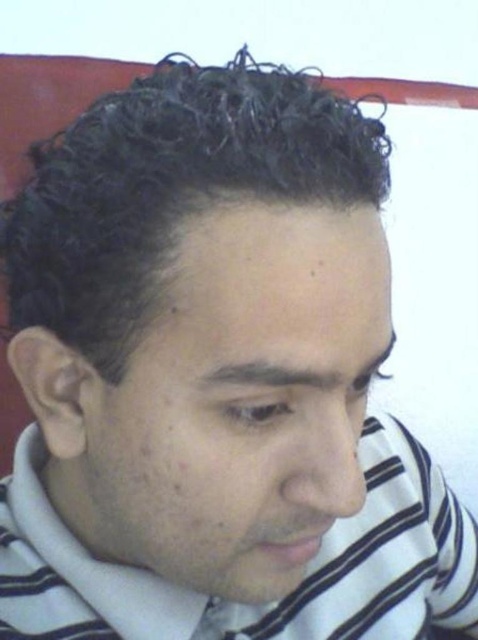
Question: Which point is closer to the camera?

Choices:
 (A) white striped dress shirt at center
 (B) curly black hair at upper center

Answer: (B)

Question: Can you confirm if curly black hair at upper center is thinner than white striped dress shirt at center?

Choices:
 (A) yes
 (B) no

Answer: (A)

Question: Which point is farther to the camera?

Choices:
 (A) curly black hair at upper center
 (B) white striped dress shirt at center

Answer: (B)

Question: Does curly black hair at upper center have a larger size compared to white striped dress shirt at center?

Choices:
 (A) no
 (B) yes

Answer: (A)

Question: Which point is closer to the camera?

Choices:
 (A) (368, 556)
 (B) (257, 116)

Answer: (B)

Question: Can you confirm if curly black hair at upper center is bigger than white striped dress shirt at center?

Choices:
 (A) yes
 (B) no

Answer: (B)